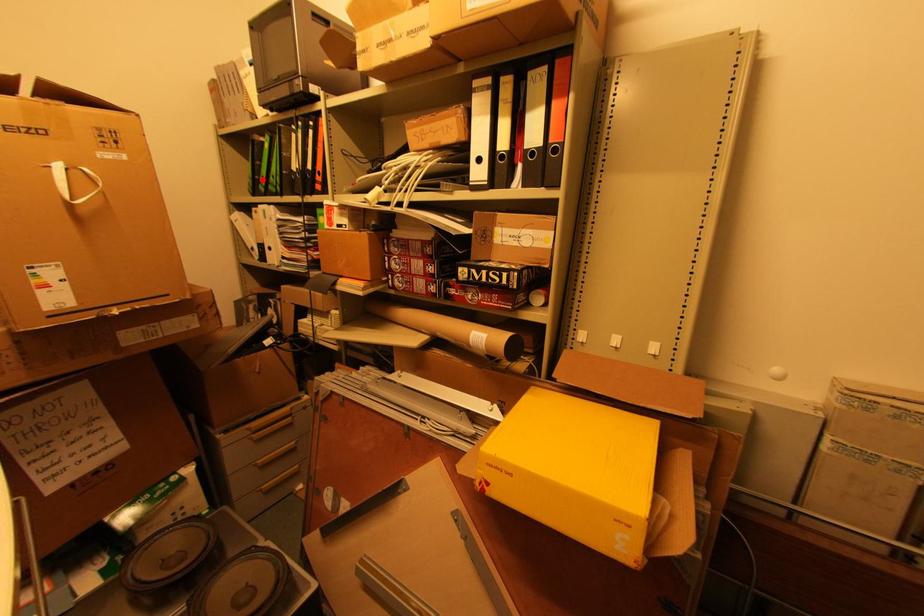
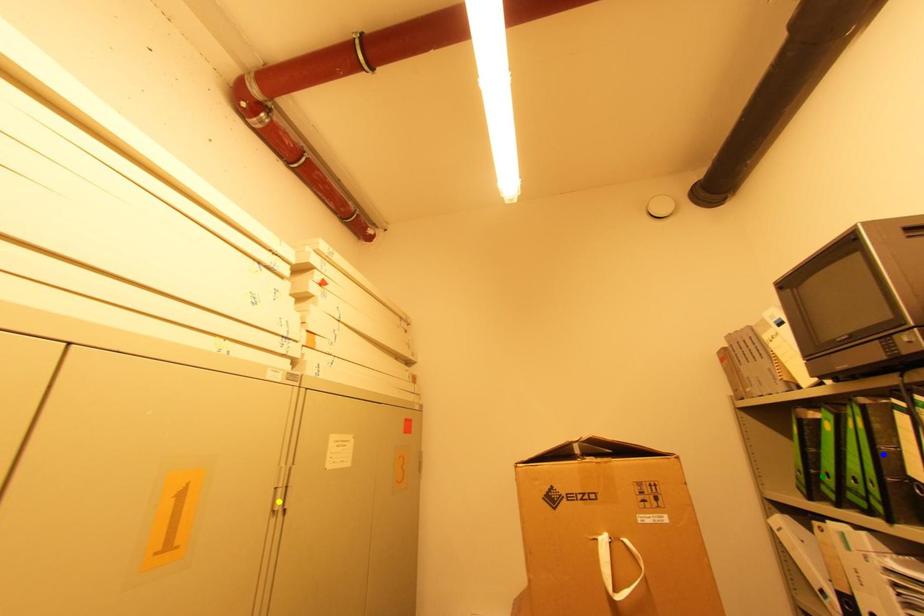
Question: I am providing you with two images of the same scene from different viewpoints. A red point is marked on the first image. You are given multiple points on the second image. Which spot in image 2 lines up with the point in image 1?

Choices:
 (A) yellow point
 (B) green point
 (C) blue point

Answer: (B)